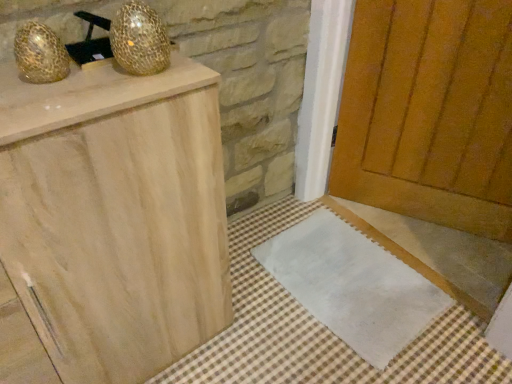
Question: Is gold mesh disco ball at upper left, the 2th disco ball when ordered from left to right, at the back of wooden door at center?

Choices:
 (A) yes
 (B) no

Answer: (B)

Question: From a real-world perspective, is wooden door at center physically above gold mesh disco ball at upper left, the first disco ball when ordered from right to left?

Choices:
 (A) yes
 (B) no

Answer: (B)

Question: Is wooden door at center touching gold mesh disco ball at upper left, the 2th disco ball when ordered from left to right?

Choices:
 (A) no
 (B) yes

Answer: (A)

Question: Is wooden door at center positioned in front of gold mesh disco ball at upper left, the first disco ball when ordered from right to left?

Choices:
 (A) yes
 (B) no

Answer: (B)

Question: Does wooden door at center appear on the right side of gold mesh disco ball at upper left, the first disco ball when ordered from right to left?

Choices:
 (A) yes
 (B) no

Answer: (A)

Question: Is wooden door at center far from gold mesh disco ball at upper left, the first disco ball when ordered from right to left?

Choices:
 (A) yes
 (B) no

Answer: (A)

Question: Is white fabric doormat at lower center not within gold textured egg at upper left, the second disco ball viewed from the right?

Choices:
 (A) yes
 (B) no

Answer: (A)

Question: Is white fabric doormat at lower center next to gold textured egg at upper left, the 1th disco ball in the left-to-right sequence, and touching it?

Choices:
 (A) no
 (B) yes

Answer: (A)

Question: From the image's perspective, is white fabric doormat at lower center over gold textured egg at upper left, the second disco ball viewed from the right?

Choices:
 (A) yes
 (B) no

Answer: (B)

Question: Considering the relative sizes of white fabric doormat at lower center and gold textured egg at upper left, the second disco ball viewed from the right, in the image provided, is white fabric doormat at lower center shorter than gold textured egg at upper left, the second disco ball viewed from the right,?

Choices:
 (A) no
 (B) yes

Answer: (B)

Question: Is white fabric doormat at lower center further to the viewer compared to gold textured egg at upper left, the second disco ball viewed from the right?

Choices:
 (A) no
 (B) yes

Answer: (B)

Question: Is white fabric doormat at lower center to the left of gold textured egg at upper left, the second disco ball viewed from the right, from the viewer's perspective?

Choices:
 (A) no
 (B) yes

Answer: (A)

Question: Is white fabric doormat at lower center oriented towards gold mesh disco ball at upper left, the first disco ball when ordered from right to left?

Choices:
 (A) no
 (B) yes

Answer: (A)